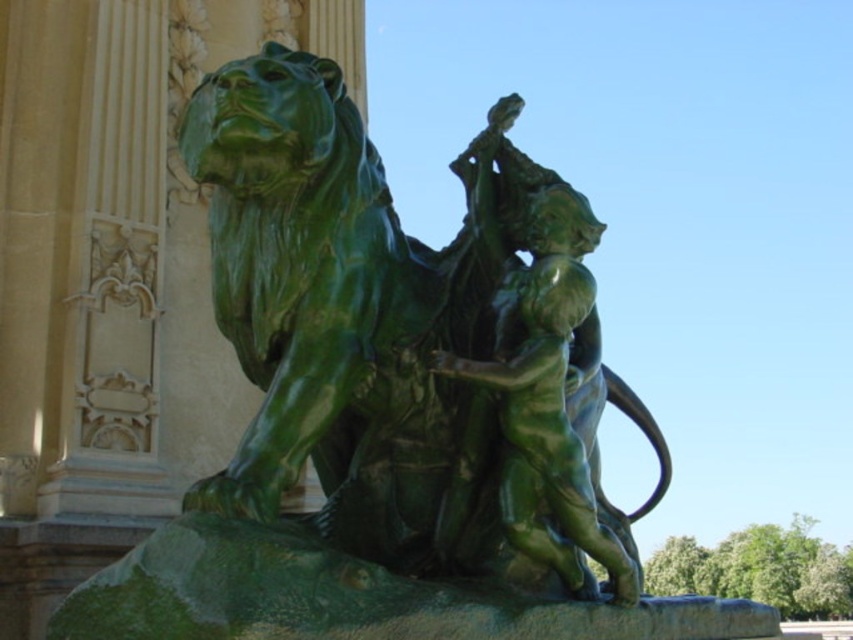
Question: Which object is farther from the camera taking this photo?

Choices:
 (A) green polished stone lion at center
 (B) green polished bronze man at center

Answer: (B)

Question: Which object appears closest to the camera in this image?

Choices:
 (A) green polished stone lion at center
 (B) green polished bronze man at center

Answer: (A)

Question: Is green polished stone lion at center positioned before green polished bronze man at center?

Choices:
 (A) yes
 (B) no

Answer: (A)

Question: Is green polished stone lion at center wider than green polished bronze man at center?

Choices:
 (A) yes
 (B) no

Answer: (A)

Question: Is green polished stone lion at center thinner than green polished bronze man at center?

Choices:
 (A) yes
 (B) no

Answer: (B)